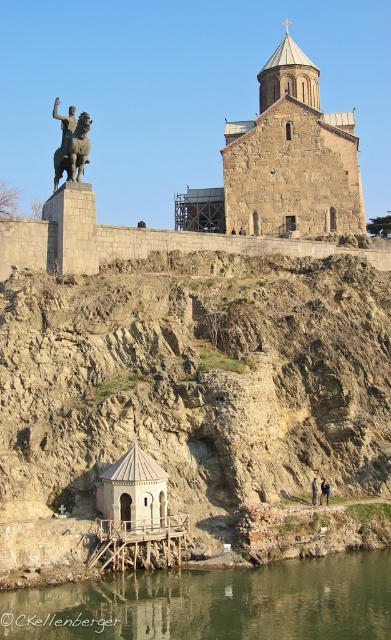
Question: Does greenish water at lower center have a lesser width compared to brown stone church at upper center?

Choices:
 (A) no
 (B) yes

Answer: (B)

Question: Which of the following is the farthest from the observer?

Choices:
 (A) bronze statue at upper left
 (B) dark brown leather jacket at lower center
 (C) greenish water at lower center
 (D) brown rocky hillside at center

Answer: (A)

Question: Which of these objects is positioned farthest from the dark brown leather jacket at lower center?

Choices:
 (A) brown leather jacket at lower center
 (B) brown stone church at upper center
 (C) brown rocky hillside at center
 (D) bronze statue at upper left

Answer: (D)

Question: Which point is farther from the camera taking this photo?

Choices:
 (A) (347, 221)
 (B) (371, 586)
 (C) (317, 493)

Answer: (A)

Question: Where is brown rocky hillside at center located in relation to brown leather jacket at lower center in the image?

Choices:
 (A) below
 (B) above

Answer: (B)

Question: Is greenish water at lower center above bronze statue at upper left?

Choices:
 (A) no
 (B) yes

Answer: (A)